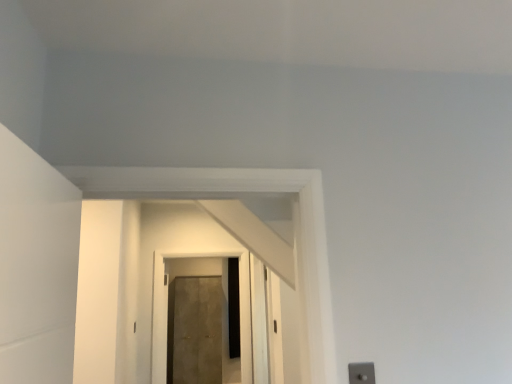
Question: Considering the positions of point (215, 340) and point (230, 253), is point (215, 340) closer or farther from the camera than point (230, 253)?

Choices:
 (A) farther
 (B) closer

Answer: (A)

Question: Based on their positions, is matte concrete door at center, the 1th door from the back, located to the left or right of matte brown door at center, marked as the second door in a back-to-front arrangement?

Choices:
 (A) right
 (B) left

Answer: (B)

Question: Which of these objects is positioned closest to the matte brown door at center, marked as the second door in a back-to-front arrangement?

Choices:
 (A) matte concrete door at center, placed as the second door when sorted from front to back
 (B) silver metallic switch at lower right

Answer: (A)

Question: Based on their relative distances, which object is farther from the silver metallic switch at lower right?

Choices:
 (A) matte concrete door at center, placed as the second door when sorted from front to back
 (B) matte brown door at center, which appears as the first door when viewed from the front

Answer: (A)